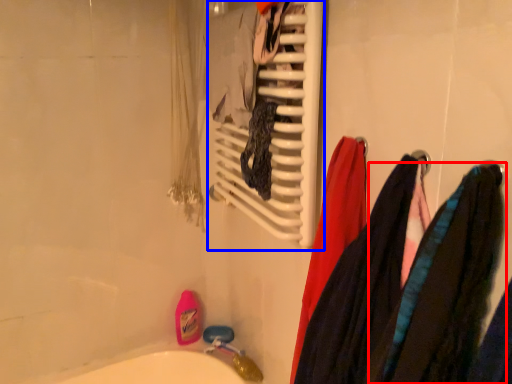
Question: Which object appears closest to the camera in this image, clothing (highlighted by a red box) or towel rack (highlighted by a blue box)?

Choices:
 (A) clothing
 (B) towel rack

Answer: (A)